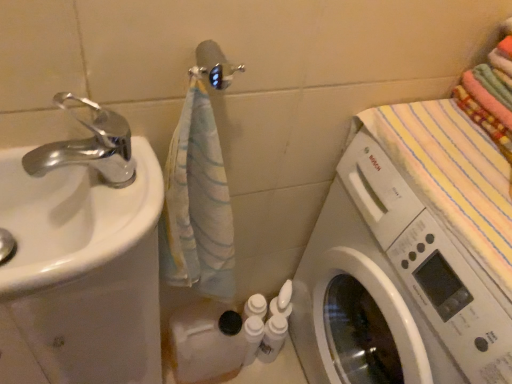
Question: Based on their sizes in the image, would you say white plastic washing machine at right is bigger or smaller than white glossy sink at left?

Choices:
 (A) big
 (B) small

Answer: (A)

Question: From a real-world perspective, is white plastic washing machine at right positioned above or below white glossy sink at left?

Choices:
 (A) above
 (B) below

Answer: (B)

Question: Considering the real-world distances, which object is farthest from the white plastic bottles at center, the 1th toiletry viewed from the left?

Choices:
 (A) white glossy sink at left
 (B) white glossy bottles at lower center, the 2th toiletry when ordered from left to right
 (C) chrome metallic faucet at left
 (D) white plastic washing machine at right

Answer: (C)

Question: Which object is the farthest from the white glossy bottles at lower center, which appears as the first toiletry when viewed from the right?

Choices:
 (A) white plastic bottles at center, the 1th toiletry viewed from the left
 (B) chrome metallic faucet at left
 (C) white plastic washing machine at right
 (D) white glossy sink at left

Answer: (B)